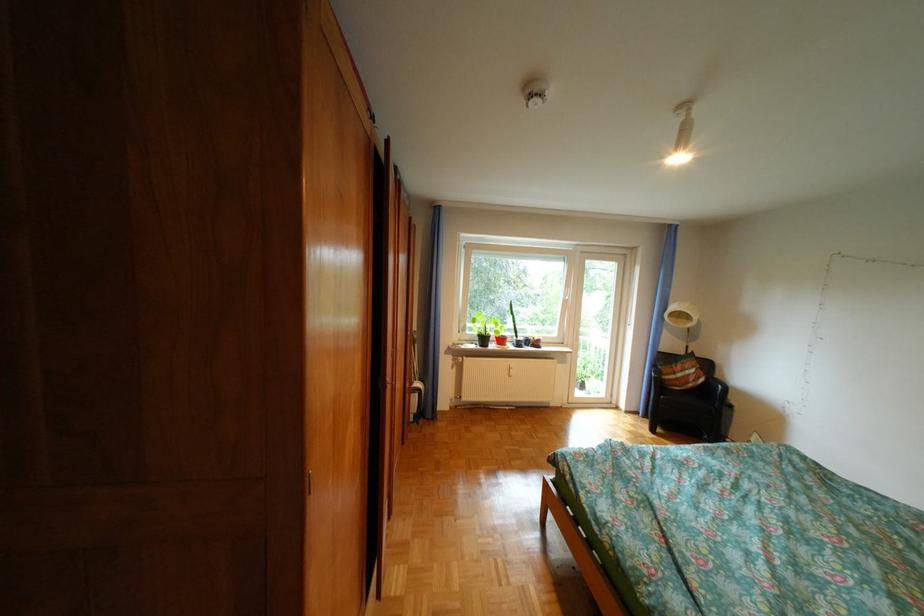
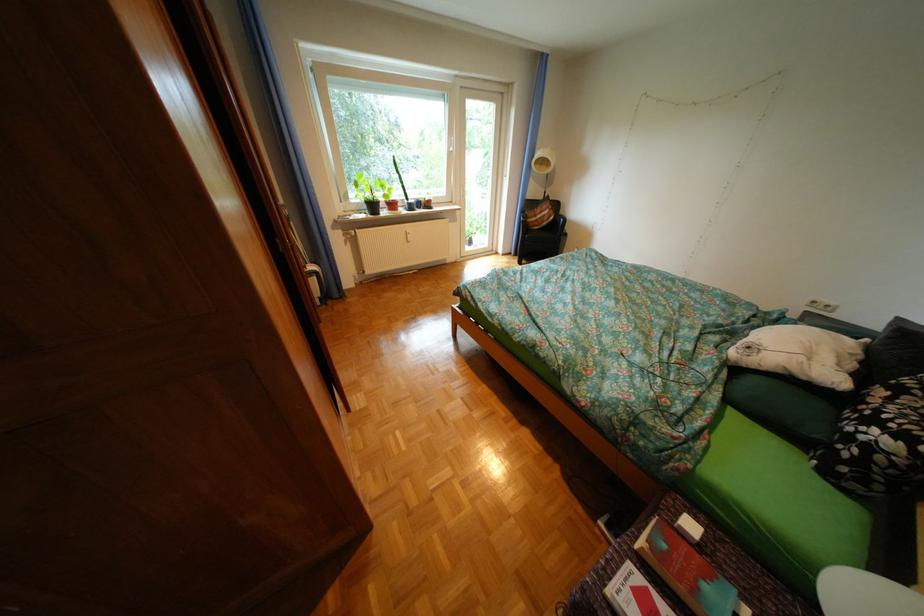
Where in the second image is the point corresponding to the highlighted location from the first image?

(387, 207)